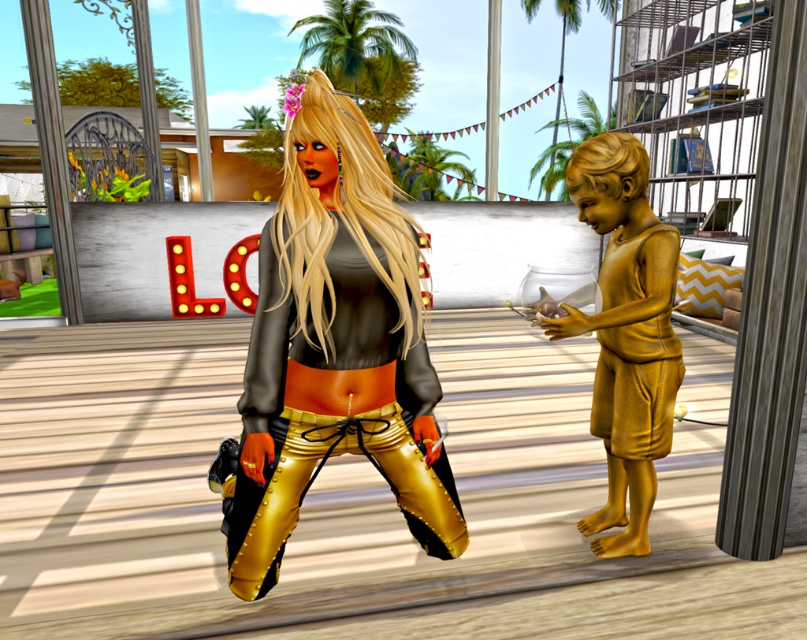
You are a game character who needs to pass through a narrow corridor that can only accommodate objects wider than 1 meter. You see the metallic gold pants at center and the gold metallic statue at right in the scene. Which object is wider and can fit through the corridor?

The metallic gold pants at center is wider than the gold metallic statue at right, so it can fit through the corridor if its width surpasses 1 meter. However, the exact width isn

You are a character in the game and need to hide behind an object. Which object would be better to hide behind, the metallic gold pants at center or the gold metallic statue at right?

The gold metallic statue at right is shorter than the metallic gold pants at center, so hiding behind the metallic gold pants at center would provide better cover.

Based on the scene description, can you determine which object is closer to the viewer between the metallic gold pants at center and the gold metallic statue at right?

The metallic gold pants at center are closer to the viewer because they are positioned over the gold metallic statue at right.